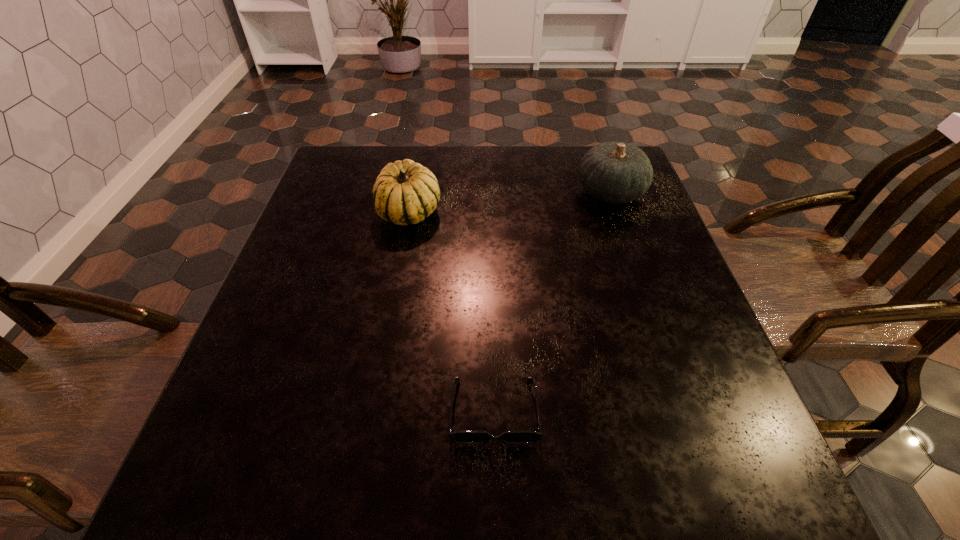
Where is `the right gourd`? The height and width of the screenshot is (540, 960). the right gourd is located at coordinates (614, 172).

Where is `the leftmost object`? The width and height of the screenshot is (960, 540). the leftmost object is located at coordinates (405, 192).

Locate an element on the screen. the shortest object is located at coordinates (458, 437).

Where is `the nearest object`? This screenshot has width=960, height=540. the nearest object is located at coordinates (458, 437).

At what (x,y) coordinates should I click in order to perform the action: click on vacant area situated 0.110m on the back of the rightmost object. Please return your answer as a coordinate pair (x, y). The height and width of the screenshot is (540, 960). Looking at the image, I should click on (596, 153).

The image size is (960, 540). I want to click on vacant region located on the back of the left gourd, so click(418, 164).

Where is `vacant point located on the front-facing side of the sunglasses`? The height and width of the screenshot is (540, 960). vacant point located on the front-facing side of the sunglasses is located at coordinates (496, 489).

The height and width of the screenshot is (540, 960). What are the coordinates of `object that is at the right edge` in the screenshot? It's located at (614, 172).

The width and height of the screenshot is (960, 540). I want to click on object positioned at the far right corner, so click(x=614, y=172).

Image resolution: width=960 pixels, height=540 pixels. In order to click on blank space at the far edge of the desktop in this screenshot , I will do `click(439, 146)`.